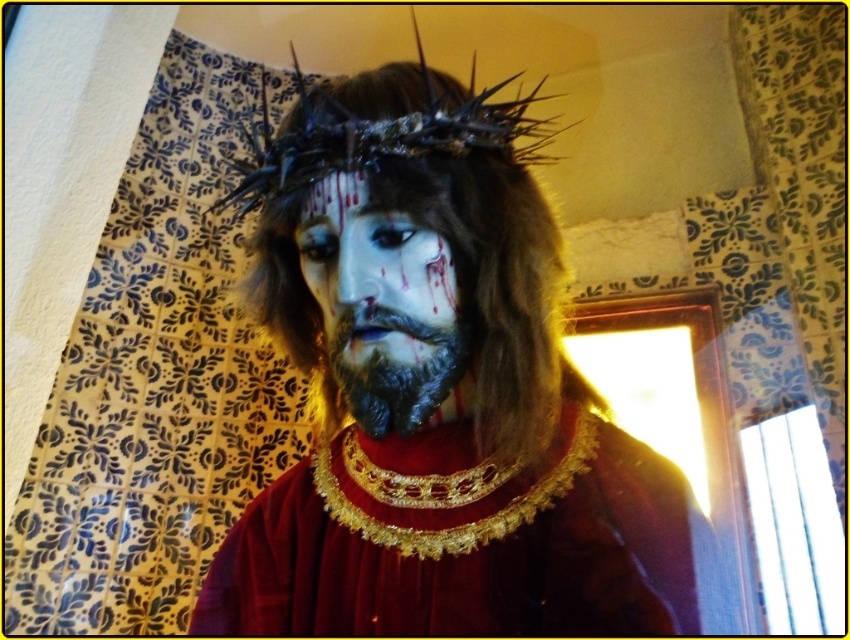
Can you confirm if dark matte beard at center is positioned to the right of matte black forehead at center?

Correct, you'll find dark matte beard at center to the right of matte black forehead at center.

Does dark matte beard at center appear under matte black forehead at center?

Correct, dark matte beard at center is located below matte black forehead at center.

The height and width of the screenshot is (640, 850). Identify the location of dark matte beard at center. (395, 369).

Does gold textured necklace at center come in front of matte black face at center?

No, it is behind matte black face at center.

Consider the image. Who is more forward, (496, 563) or (425, 266)?

Point (425, 266) is more forward.

Is point (466, 556) positioned after point (394, 340)?

That is True.

This screenshot has width=850, height=640. I want to click on gold textured necklace at center, so click(469, 540).

Is point (392, 125) more distant than point (332, 182)?

No.

What do you see at coordinates (367, 177) in the screenshot? The height and width of the screenshot is (640, 850). I see `matte black crown at center` at bounding box center [367, 177].

The height and width of the screenshot is (640, 850). Find the location of `matte black crown at center`. matte black crown at center is located at coordinates (367, 177).